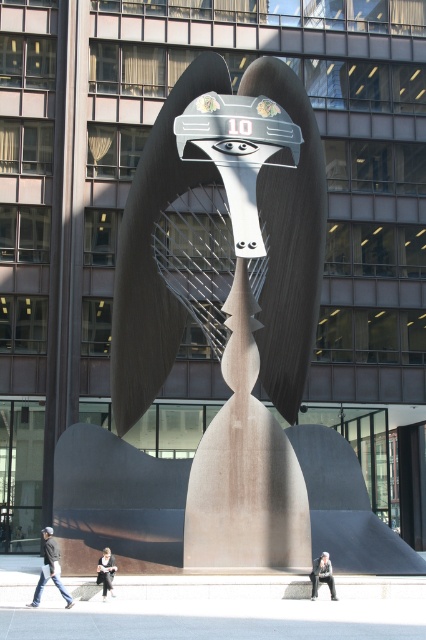
Does matte bronze sculpture at center have a lesser height compared to dark blue jeans at lower left?

Incorrect, matte bronze sculpture at center's height does not fall short of dark blue jeans at lower left's.

Is matte bronze sculpture at center to the right of dark blue jeans at lower left from the viewer's perspective?

Yes, matte bronze sculpture at center is to the right of dark blue jeans at lower left.

Between point (54, 518) and point (46, 566), which one is positioned behind?

Point (54, 518)

Where is `matte bronze sculpture at center`? matte bronze sculpture at center is located at coordinates (117, 502).

Is dark blue jeans at lower left further to the viewer compared to dark gray concrete statue at center?

No, it is in front of dark gray concrete statue at center.

Can you confirm if dark blue jeans at lower left is smaller than dark gray concrete statue at center?

No, dark blue jeans at lower left is not smaller than dark gray concrete statue at center.

Which is in front, point (36, 602) or point (314, 598)?

Point (36, 602) is in front.

Find the location of a particular element. dark blue jeans at lower left is located at coordinates (49, 570).

Is dark blue jeans at lower left behind dark gray concrete figure at center?

No, dark blue jeans at lower left is in front of dark gray concrete figure at center.

Between point (51, 550) and point (109, 556), which one is positioned behind?

The point (109, 556) is behind.

Where is `dark blue jeans at lower left`? This screenshot has width=426, height=640. dark blue jeans at lower left is located at coordinates (49, 570).